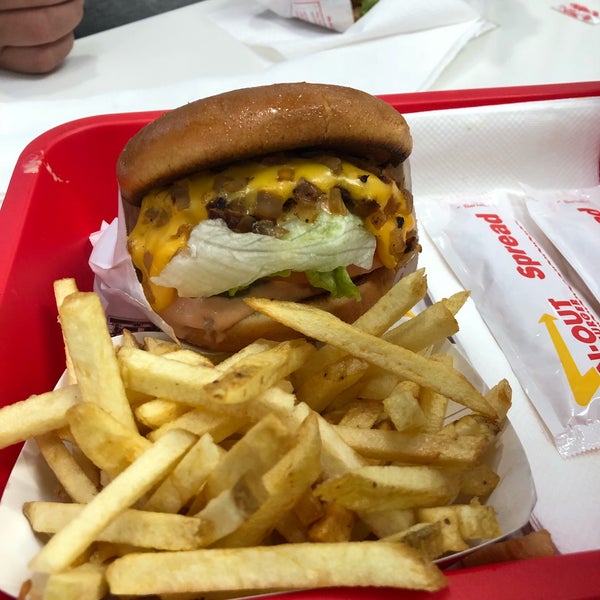
The width and height of the screenshot is (600, 600). In order to click on white tray in this screenshot , I will do `click(528, 483)`.